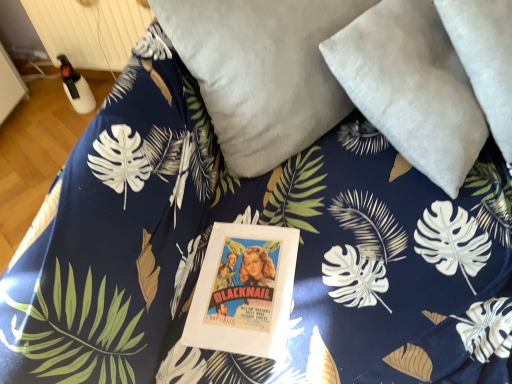
Question: Is point (117, 21) positioned closer to the camera than point (222, 86)?

Choices:
 (A) closer
 (B) farther

Answer: (B)

Question: Choose the correct answer: Is white plastic radiator at upper left inside velvety gray pillow at upper center, the second pillow in the right-to-left sequence, or outside it?

Choices:
 (A) outside
 (B) inside

Answer: (A)

Question: Estimate the real-world distances between objects in this image. Which object is closer to the velvety gray pillow at upper center, the second pillow in the right-to-left sequence?

Choices:
 (A) suede-like gray pillow at upper right, the second pillow from the left
 (B) white plastic radiator at upper left

Answer: (A)

Question: Which object is the farthest from the velvety gray pillow at upper center, the second pillow in the right-to-left sequence?

Choices:
 (A) suede-like gray pillow at upper right, the second pillow from the left
 (B) white plastic radiator at upper left

Answer: (B)